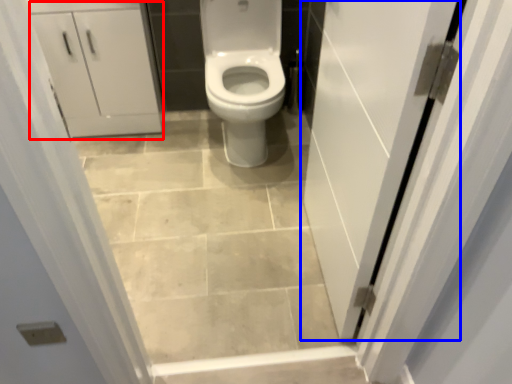
Question: Which object is further to the camera taking this photo, cabinetry (highlighted by a red box) or door (highlighted by a blue box)?

Choices:
 (A) cabinetry
 (B) door

Answer: (A)